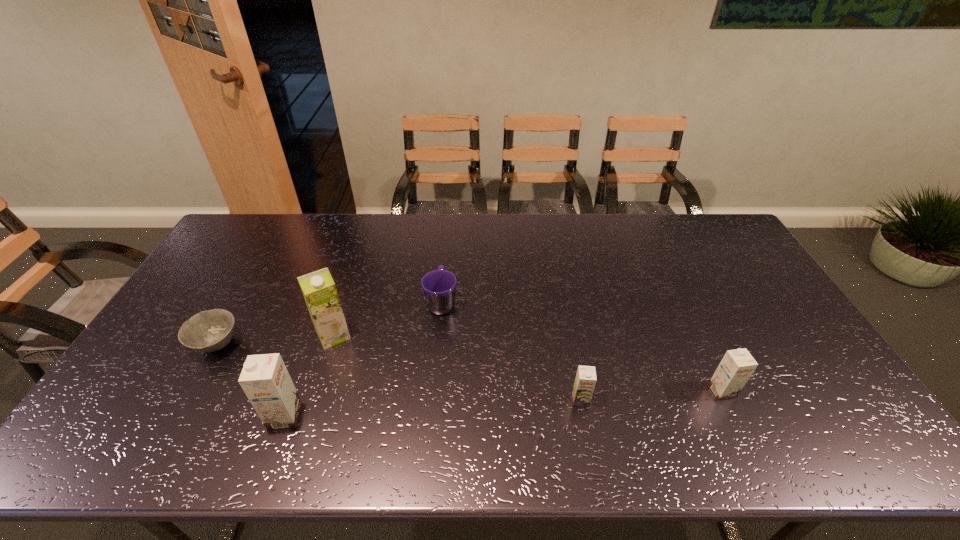
Where is `the tallest chocolate milk`? the tallest chocolate milk is located at coordinates (265, 380).

Where is `the shortest chocolate milk`? This screenshot has width=960, height=540. the shortest chocolate milk is located at coordinates (585, 381).

In order to click on the second chocolate milk from right to left in this screenshot , I will do `click(585, 381)`.

I want to click on the fourth shortest object, so 736,367.

Locate an element on the screen. the second shortest chocolate milk is located at coordinates (736, 367).

The height and width of the screenshot is (540, 960). I want to click on the shortest object, so click(x=208, y=331).

This screenshot has height=540, width=960. Identify the location of the leftmost object. (208, 331).

Identify the location of the third object from right to left. coord(439,286).

Identify the location of mug. (439, 286).

Find the location of a particular element. The image size is (960, 540). soya milk is located at coordinates (318, 288).